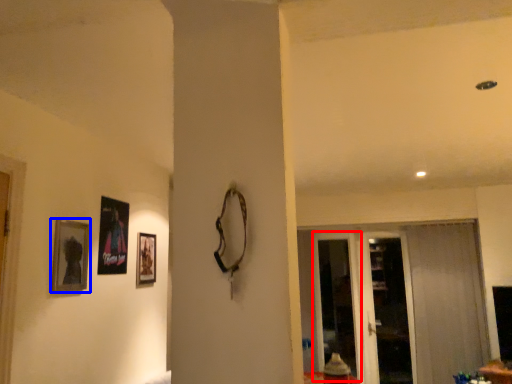
Question: Which object appears closest to the camera in this image, screen door (highlighted by a red box) or picture frame (highlighted by a blue box)?

Choices:
 (A) screen door
 (B) picture frame

Answer: (B)